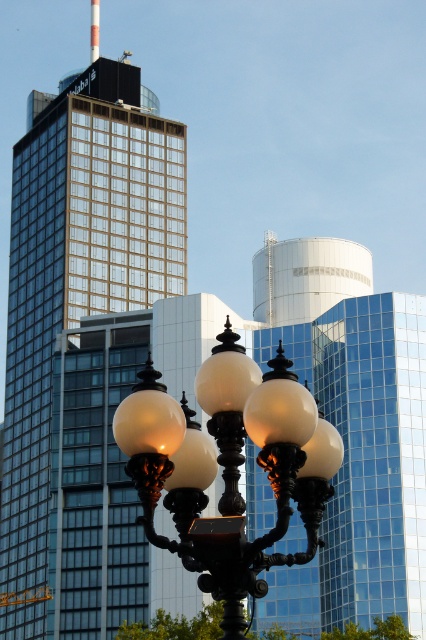
You are standing in the middle of the street looking at the scene. Which object is positioned to the right of the other between the matte glass skyscraper at center and the matte black street light at center?

The matte black street light at center is positioned to the right of the matte glass skyscraper at center because the skyscraper is to the left of the street light.

You are standing in the city square and want to take a photo of the matte glass skyscraper at center and the matte black street light at center. Which object should you focus on first if you want to capture both in a single shot without moving the camera?

You should focus on the matte black street light at center first because it is closer to you than the matte glass skyscraper at center, allowing both objects to be in focus when using a camera with a fixed focal point.